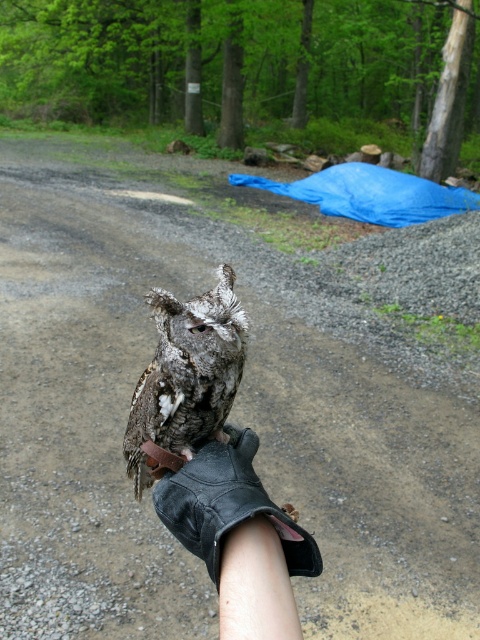
Question: Can you confirm if black leather glove at center is positioned to the left of speckled feathered owl at center?

Choices:
 (A) yes
 (B) no

Answer: (B)

Question: Is black leather glove at center above speckled feathered owl at center?

Choices:
 (A) no
 (B) yes

Answer: (A)

Question: Which object is closer to the camera taking this photo?

Choices:
 (A) black leather glove at center
 (B) speckled feathered owl at center

Answer: (A)

Question: Is black leather glove at center closer to camera compared to speckled feathered owl at center?

Choices:
 (A) yes
 (B) no

Answer: (A)